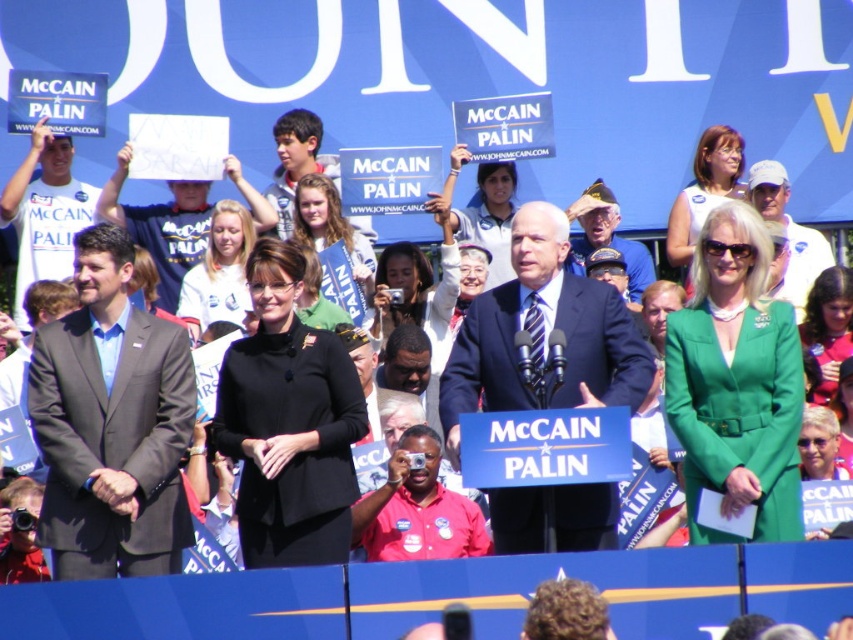
Which is more to the left, black matte suit at center or dark blue suit at center?

black matte suit at center

Can you confirm if black matte suit at center is positioned to the left of dark blue suit at center?

Correct, you'll find black matte suit at center to the left of dark blue suit at center.

Is point (254, 429) closer to camera compared to point (461, 355)?

Yes, point (254, 429) is in front of point (461, 355).

Identify the location of black matte suit at center. (289, 422).

Is the position of blue fabric banner at upper center more distant than that of dark blue suit at center?

Yes, blue fabric banner at upper center is further from the viewer.

Consider the image. Which of these two, blue fabric banner at upper center or dark blue suit at center, stands taller?

With more height is blue fabric banner at upper center.

The image size is (853, 640). I want to click on blue fabric banner at upper center, so click(813, 294).

Is point (160, 492) farther from viewer compared to point (300, 266)?

That is False.

Is point (51, 490) less distant than point (292, 508)?

Yes, it is in front of point (292, 508).

Locate an element on the screen. The height and width of the screenshot is (640, 853). dark gray suit at left is located at coordinates 111,422.